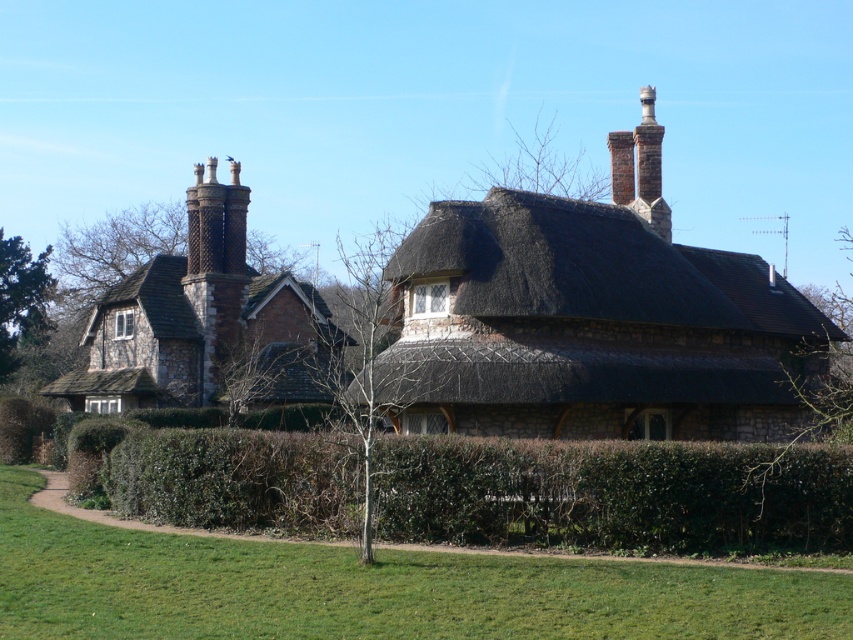
Question: Which of these objects is positioned farthest from the bare branches at upper right?

Choices:
 (A) green leafy tree at center
 (B) thatched roof at center
 (C) green leafy tree at left
 (D) green leafy hedge at lower center

Answer: (C)

Question: Can you confirm if thatched roof at center is positioned above bare branches at upper right?

Choices:
 (A) yes
 (B) no

Answer: (A)

Question: Which is nearer to the rustic stone chimney at upper left?

Choices:
 (A) thatched roof at center
 (B) green leafy tree at center
 (C) bare branches at upper right

Answer: (B)

Question: Which object is positioned closest to the green leafy tree at center?

Choices:
 (A) bare branches at upper right
 (B) rustic stone chimney at upper left
 (C) green leafy tree at left

Answer: (B)

Question: Does green leafy hedge at lower center appear on the right side of thatched roof at center?

Choices:
 (A) yes
 (B) no

Answer: (B)

Question: Does green leafy hedge at lower center have a lesser width compared to green leafy tree at center?

Choices:
 (A) no
 (B) yes

Answer: (B)